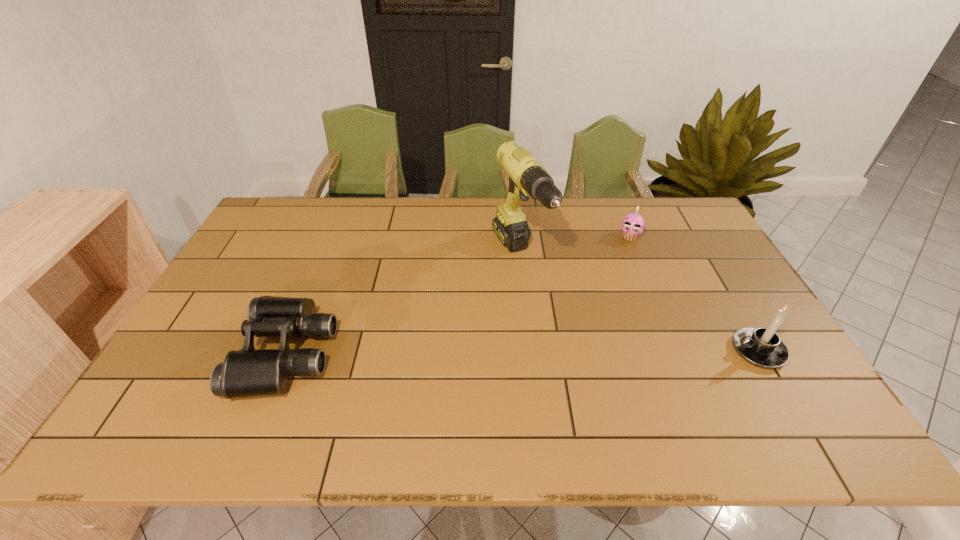
The width and height of the screenshot is (960, 540). Find the location of `the leftmost object`. the leftmost object is located at coordinates (248, 372).

Locate an element on the screen. the rightmost object is located at coordinates (762, 347).

Locate an element on the screen. This screenshot has width=960, height=540. the second tallest object is located at coordinates (762, 347).

Find the location of `the tallest object`. the tallest object is located at coordinates tap(527, 177).

Locate an element on the screen. the third object from right to left is located at coordinates (527, 177).

Identify the location of the third object from left to right. (633, 224).

Where is `vacant space situated 0.060m on the front-facing side of the binoculars`? vacant space situated 0.060m on the front-facing side of the binoculars is located at coordinates (219, 353).

The image size is (960, 540). Find the location of `vacant space located 0.160m on the front-facing side of the binoculars`. vacant space located 0.160m on the front-facing side of the binoculars is located at coordinates (180, 353).

In order to click on vacant space located 0.130m on the front-facing side of the binoculars in this screenshot , I will do `click(191, 353)`.

This screenshot has height=540, width=960. Find the location of `vacant space located 0.090m with a handle on the side of the rightmost object`. vacant space located 0.090m with a handle on the side of the rightmost object is located at coordinates (697, 351).